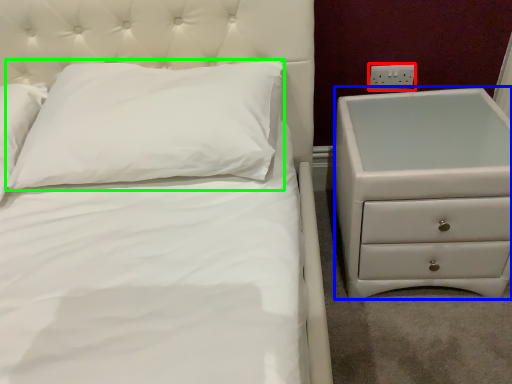
Question: Estimate the real-world distances between objects in this image. Which object is farther from electric outlet (highlighted by a red box), chest of drawers (highlighted by a blue box) or pillow (highlighted by a green box)?

Choices:
 (A) chest of drawers
 (B) pillow

Answer: (B)